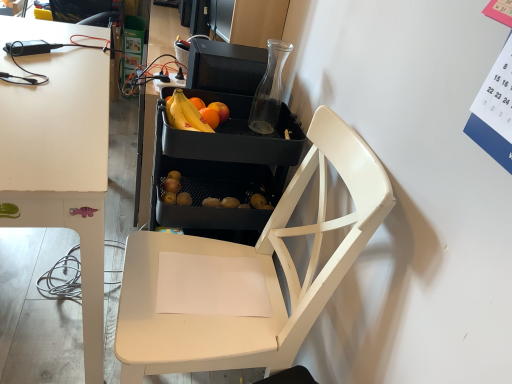
Question: From a real-world perspective, is white matte chair at center positioned under matte black fruit at center based on gravity?

Choices:
 (A) yes
 (B) no

Answer: (A)

Question: From a real-world perspective, is white matte chair at center located higher than matte black fruit at center?

Choices:
 (A) no
 (B) yes

Answer: (A)

Question: Is white matte chair at center at the right side of matte black fruit at center?

Choices:
 (A) no
 (B) yes

Answer: (B)

Question: From the image's perspective, is white matte chair at center above matte black fruit at center?

Choices:
 (A) yes
 (B) no

Answer: (B)

Question: Is white matte chair at center bigger than matte black fruit at center?

Choices:
 (A) yes
 (B) no

Answer: (A)

Question: In terms of size, does white matte chair at center appear bigger or smaller than black plastic tray at center?

Choices:
 (A) small
 (B) big

Answer: (A)

Question: Relative to black plastic tray at center, is white matte chair at center in front or behind?

Choices:
 (A) front
 (B) behind

Answer: (A)

Question: Looking at their shapes, would you say white matte chair at center is wider or thinner than black plastic tray at center?

Choices:
 (A) wide
 (B) thin

Answer: (A)

Question: Is white matte chair at center to the left or to the right of black plastic tray at center in the image?

Choices:
 (A) left
 (B) right

Answer: (B)

Question: Does point (200, 210) appear closer or farther from the camera than point (226, 334)?

Choices:
 (A) closer
 (B) farther

Answer: (B)

Question: In terms of height, does black plastic tray at center look taller or shorter compared to white matte chair at center?

Choices:
 (A) short
 (B) tall

Answer: (B)

Question: Is black plastic tray at center in front of or behind white matte chair at center in the image?

Choices:
 (A) behind
 (B) front

Answer: (A)

Question: From the image's perspective, is black plastic tray at center above or below white matte chair at center?

Choices:
 (A) above
 (B) below

Answer: (A)

Question: Considering the relative positions of white matte desk at left and matte black fruit at center in the image provided, is white matte desk at left to the left or to the right of matte black fruit at center?

Choices:
 (A) right
 (B) left

Answer: (B)

Question: In terms of size, does white matte desk at left appear bigger or smaller than matte black fruit at center?

Choices:
 (A) big
 (B) small

Answer: (A)